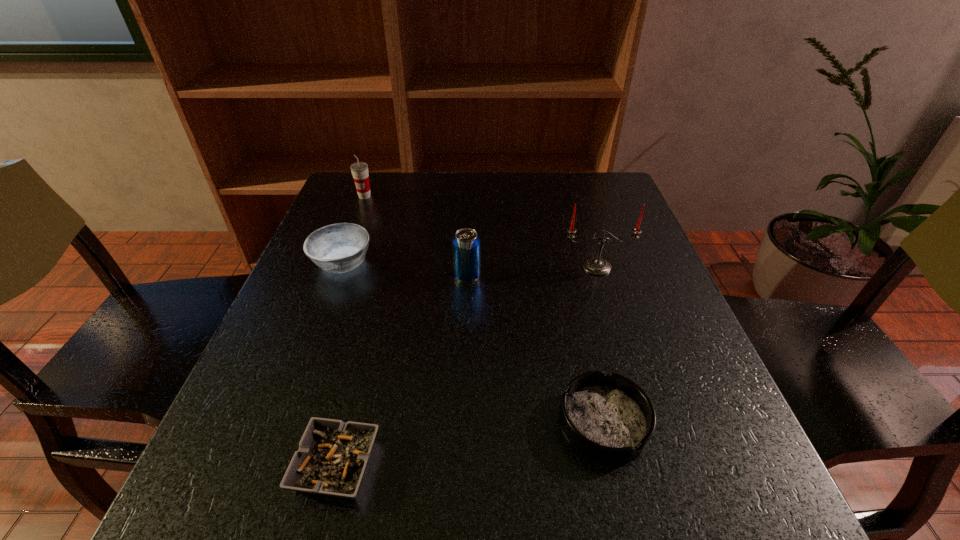
Identify the location of vacant area that lies between the beer can and the shortest ashtray. The image size is (960, 540). (402, 370).

The height and width of the screenshot is (540, 960). Identify the location of free area in between the rightmost ashtray and the farthest ashtray. (473, 342).

The height and width of the screenshot is (540, 960). What are the coordinates of `free spot between the beer can and the farthest object` in the screenshot? It's located at (416, 236).

Where is `empty space between the fourth object from left to right and the candle`? This screenshot has height=540, width=960. empty space between the fourth object from left to right and the candle is located at coordinates (532, 271).

You are a GUI agent. You are given a task and a screenshot of the screen. Output one action in this format:
    pyautogui.click(x=<x>, y=<y>)
    Task: Click on the empty space between the farthest object and the shortest ashtray
    
    Given the screenshot: What is the action you would take?
    pyautogui.click(x=350, y=330)

Locate an element on the screen. vacant area between the candle and the shortest object is located at coordinates (467, 366).

At what (x,y) coordinates should I click in order to perform the action: click on object that stands as the closest to the beer can. Please return your answer as a coordinate pair (x, y). Looking at the image, I should click on (598, 266).

Identify which object is the second nearest to the third object from right to left. Please provide its 2D coordinates. Your answer should be formatted as a tuple, i.e. [(x, y)], where the tuple contains the x and y coordinates of a point satisfying the conditions above.

[(337, 248)]

Find the location of a particular element. The image size is (960, 540). ashtray that can be found as the closest to the shortest object is located at coordinates (609, 418).

Image resolution: width=960 pixels, height=540 pixels. What are the coordinates of `ashtray that is the closest to the farthest ashtray` in the screenshot? It's located at (332, 456).